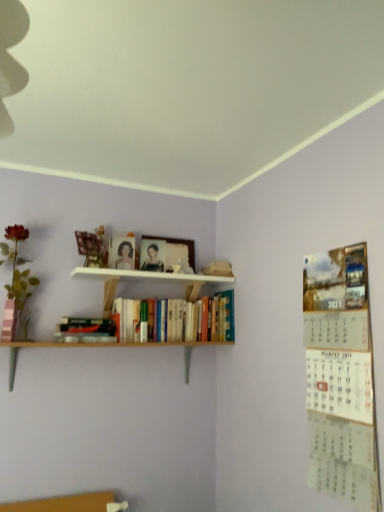
Question: Relative to hardcover book at lower left, the first book in the left-to-right sequence, is metallic paper calendar at right in front or behind?

Choices:
 (A) front
 (B) behind

Answer: (A)

Question: From their relative heights in the image, would you say metallic paper calendar at right is taller or shorter than hardcover book at lower left, the second book viewed from the right?

Choices:
 (A) tall
 (B) short

Answer: (A)

Question: Which of these objects is positioned closest to the matte black portrait at center?

Choices:
 (A) matte plastic rose at left
 (B) wooden picture frame at upper center
 (C) hardcover book at lower left, the second book viewed from the right
 (D) hardcover books at center, which is the first book in right-to-left order
 (E) metallic paper calendar at right

Answer: (B)

Question: Estimate the real-world distances between objects in this image. Which object is closer to the metallic paper calendar at right?

Choices:
 (A) hardcover books at center, which is the first book in right-to-left order
 (B) hardcover book at lower left, the second book viewed from the right
 (C) wooden picture frame at upper center
 (D) matte black portrait at center
 (E) matte plastic rose at left

Answer: (A)